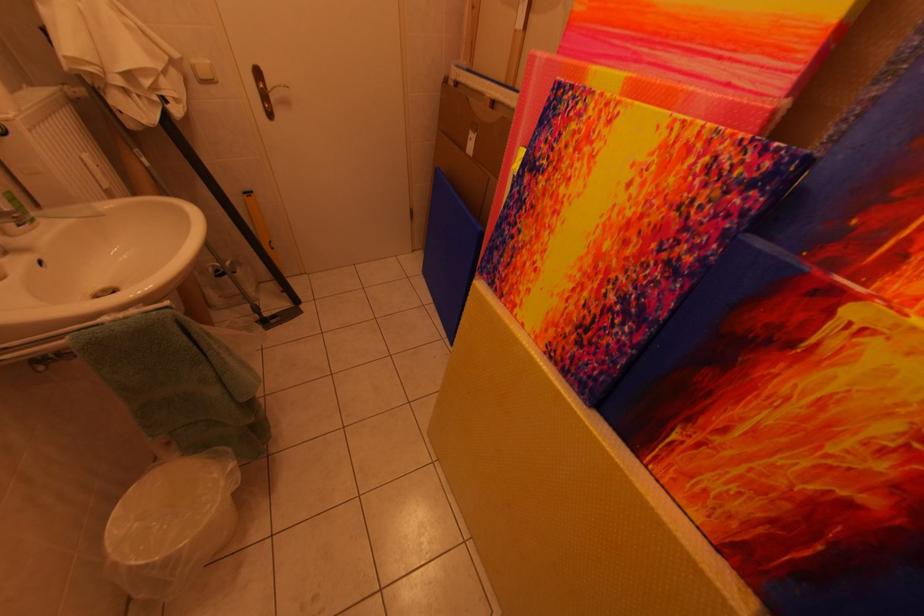
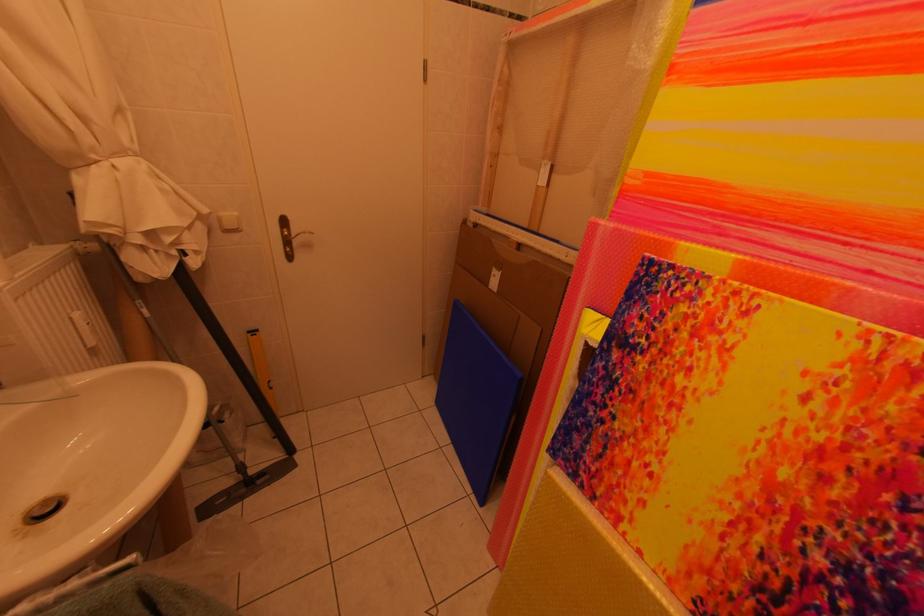
In the second image, find the point that corresponds to point 203,65 in the first image.

(229, 217)